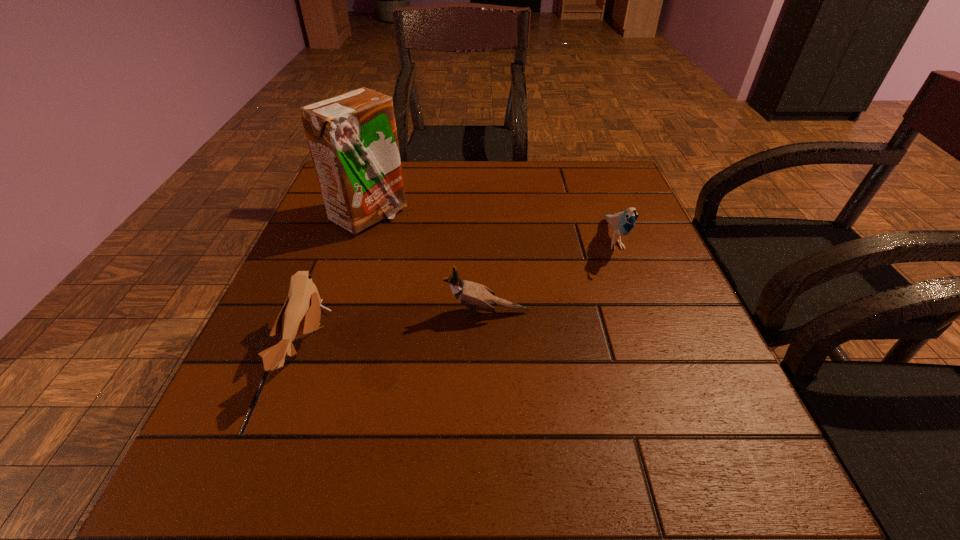
Identify the location of carton. (352, 137).

Image resolution: width=960 pixels, height=540 pixels. Find the location of `the farthest bird`. the farthest bird is located at coordinates (622, 223).

The width and height of the screenshot is (960, 540). I want to click on the rightmost object, so click(622, 223).

At what (x,y) coordinates should I click in order to perform the action: click on the third object from left to right. Please return your answer as a coordinate pair (x, y). The height and width of the screenshot is (540, 960). Looking at the image, I should click on (474, 295).

This screenshot has height=540, width=960. Find the location of `the leftmost bird`. the leftmost bird is located at coordinates (301, 313).

The height and width of the screenshot is (540, 960). Find the location of `free region located 0.400m on the straw side of the carton`. free region located 0.400m on the straw side of the carton is located at coordinates tap(570, 217).

The height and width of the screenshot is (540, 960). I want to click on vacant space located at the face of the farthest bird, so click(659, 360).

This screenshot has height=540, width=960. I want to click on free location located 0.230m at the face of the second bird from right to left, so click(x=323, y=312).

Image resolution: width=960 pixels, height=540 pixels. Identify the location of vacant region located 0.230m at the face of the second bird from right to left. (323, 312).

You are a GUI agent. You are given a task and a screenshot of the screen. Output one action in this format:
    pyautogui.click(x=<x>, y=<y>)
    Task: Click on the free location located 0.250m at the face of the second bird from right to left
    The image size is (960, 540).
    Given the screenshot: What is the action you would take?
    pyautogui.click(x=312, y=312)